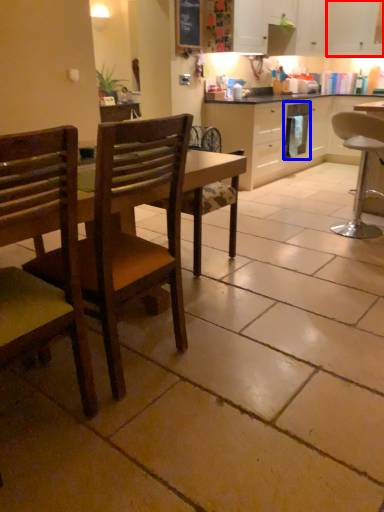
Question: Which object appears closest to the camera in this image, cabinetry (highlighted by a red box) or dish washer (highlighted by a blue box)?

Choices:
 (A) cabinetry
 (B) dish washer

Answer: (B)